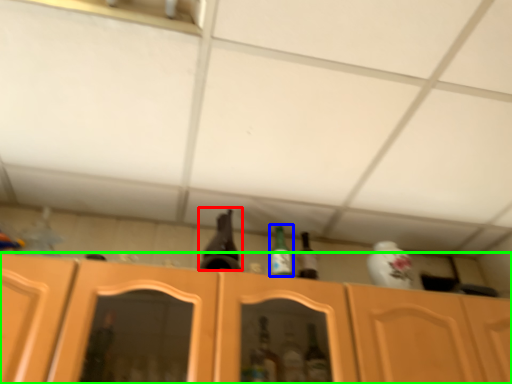
Question: Estimate the real-world distances between objects in this image. Which object is farther from beer bottle (highlighted by a red box), bottle (highlighted by a blue box) or cabinetry (highlighted by a green box)?

Choices:
 (A) bottle
 (B) cabinetry

Answer: (B)